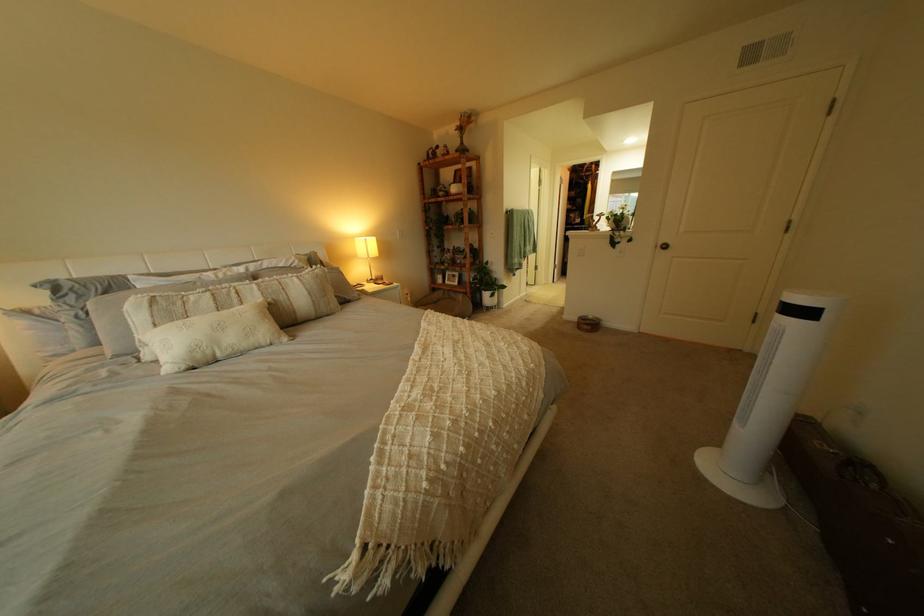
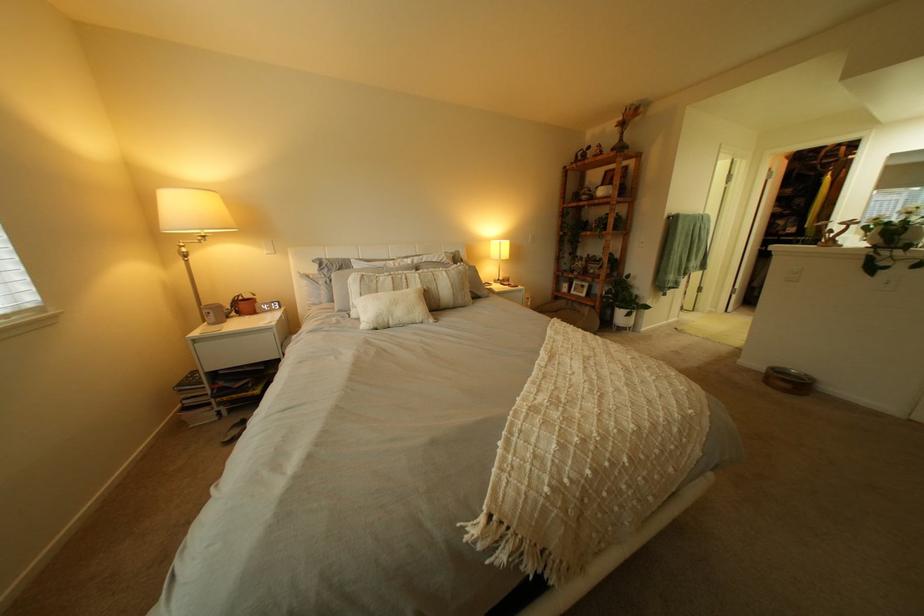
In the second image, find the point that corresponds to the point at 274,294 in the first image.

(434, 283)